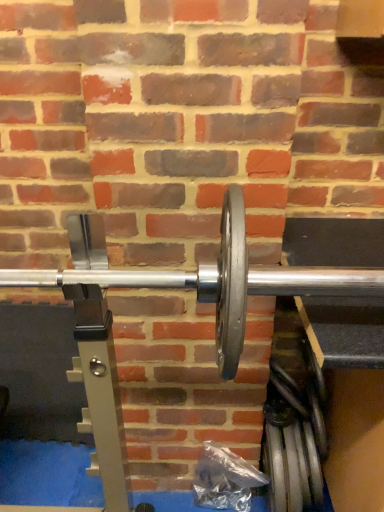
Question: Is shiny metallic weight plate at lower right wider than silver metallic dumbbell at center?

Choices:
 (A) yes
 (B) no

Answer: (B)

Question: Is shiny metallic weight plate at lower right not within silver metallic dumbbell at center?

Choices:
 (A) yes
 (B) no

Answer: (A)

Question: Can you confirm if shiny metallic weight plate at lower right is taller than silver metallic dumbbell at center?

Choices:
 (A) yes
 (B) no

Answer: (A)

Question: From the image's perspective, is shiny metallic weight plate at lower right below silver metallic dumbbell at center?

Choices:
 (A) no
 (B) yes

Answer: (B)

Question: Is shiny metallic weight plate at lower right in front of silver metallic dumbbell at center?

Choices:
 (A) no
 (B) yes

Answer: (A)

Question: Can you confirm if shiny metallic weight plate at lower right is bigger than silver metallic dumbbell at center?

Choices:
 (A) no
 (B) yes

Answer: (A)

Question: Is silver metallic dumbbell at center wider than shiny metallic weight plate at lower right?

Choices:
 (A) yes
 (B) no

Answer: (A)

Question: Does silver metallic dumbbell at center have a lesser height compared to shiny metallic weight plate at lower right?

Choices:
 (A) no
 (B) yes

Answer: (B)

Question: Is silver metallic dumbbell at center located outside shiny metallic weight plate at lower right?

Choices:
 (A) yes
 (B) no

Answer: (A)

Question: Does silver metallic dumbbell at center have a smaller size compared to shiny metallic weight plate at lower right?

Choices:
 (A) no
 (B) yes

Answer: (A)

Question: Is silver metallic dumbbell at center thinner than shiny metallic weight plate at lower right?

Choices:
 (A) no
 (B) yes

Answer: (A)

Question: Is silver metallic dumbbell at center bigger than shiny metallic weight plate at lower right?

Choices:
 (A) no
 (B) yes

Answer: (B)

Question: From a real-world perspective, is shiny metallic weight plate at lower right physically located above or below silver metallic dumbbell at center?

Choices:
 (A) below
 (B) above

Answer: (A)